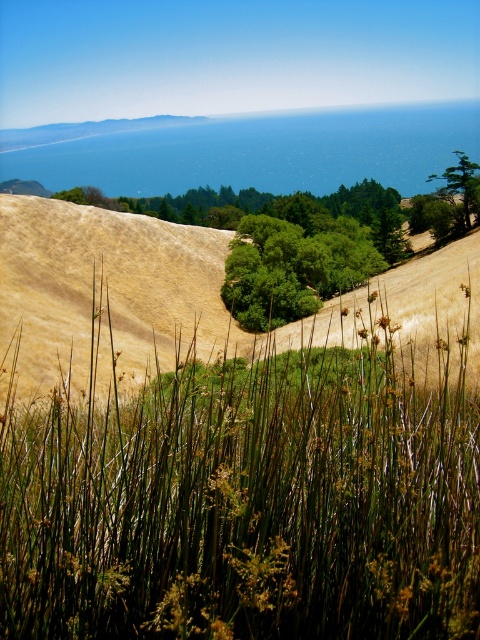
You are standing in the middle of the dry grass at center and want to walk towards the blue water at upper center. Which direction should you head?

You should head to the right because the blue water at upper center is to the right of the dry grass at center.

Looking at this image, you are standing in the middle of the dry grass at center and want to walk towards the green leafy tree at upper center. Which direction should you head?

You should head to the right because the dry grass at center is to the left of green leafy tree at upper center, meaning the tree is located to your right side.

You are standing at the base of the hills and looking at the two points marked in the image. Which point is closer to you, point (414, 323) or point (459, 189)?

Point (414, 323) is in front of point (459, 189), so it is closer to you.